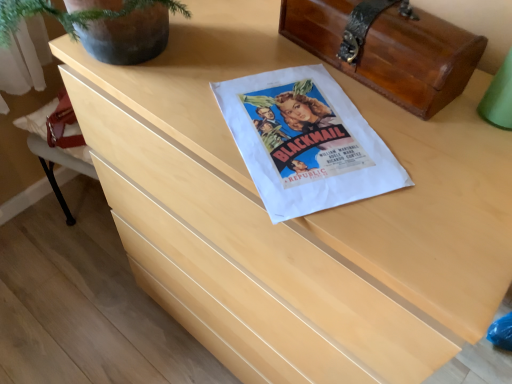
At what (x,y) coordinates should I click in order to perform the action: click on shiny brown wood chest at upper right. Please return your answer as a coordinate pair (x, y). Looking at the image, I should click on (390, 50).

What is the approximate width of shiny brown wood chest at upper right?

The width of shiny brown wood chest at upper right is 7.47 inches.

What do you see at coordinates (390, 50) in the screenshot?
I see `shiny brown wood chest at upper right` at bounding box center [390, 50].

You are a GUI agent. You are given a task and a screenshot of the screen. Output one action in this format:
    pyautogui.click(x=<x>, y=<y>)
    Task: Click on the white paper flyer at center
    
    Given the screenshot: What is the action you would take?
    pyautogui.click(x=305, y=142)

Measure the distance between white paper flyer at center and camera.

21.25 inches.

What do you see at coordinates (305, 142) in the screenshot? I see `white paper flyer at center` at bounding box center [305, 142].

Locate an element on the screen. shiny brown wood chest at upper right is located at coordinates (390, 50).

Considering the relative positions of shiny brown wood chest at upper right and white paper flyer at center in the image provided, is shiny brown wood chest at upper right to the left of white paper flyer at center from the viewer's perspective?

In fact, shiny brown wood chest at upper right is to the right of white paper flyer at center.

Considering their positions, is shiny brown wood chest at upper right located in front of or behind white paper flyer at center?

shiny brown wood chest at upper right is positioned farther from the viewer than white paper flyer at center.

Which is in front, point (431, 49) or point (251, 120)?

The point (431, 49) is closer to the camera.

From the image's perspective, is shiny brown wood chest at upper right under white paper flyer at center?

Actually, shiny brown wood chest at upper right appears above white paper flyer at center in the image.

From a real-world perspective, is shiny brown wood chest at upper right positioned above or below white paper flyer at center?

shiny brown wood chest at upper right is above white paper flyer at center.

Considering the sizes of objects shiny brown wood chest at upper right and white paper flyer at center in the image provided, who is thinner, shiny brown wood chest at upper right or white paper flyer at center?

With smaller width is shiny brown wood chest at upper right.

Is shiny brown wood chest at upper right shorter than white paper flyer at center?

Incorrect, the height of shiny brown wood chest at upper right does not fall short of that of white paper flyer at center.

Who is bigger, shiny brown wood chest at upper right or white paper flyer at center?

shiny brown wood chest at upper right is bigger.

Is white paper flyer at center surrounded by shiny brown wood chest at upper right?

No.

Based on the photo, are shiny brown wood chest at upper right and white paper flyer at center making contact?

No, shiny brown wood chest at upper right is not beside white paper flyer at center.

Is shiny brown wood chest at upper right facing away from white paper flyer at center?

No, shiny brown wood chest at upper right's orientation is not away from white paper flyer at center.

What's the angular difference between shiny brown wood chest at upper right and white paper flyer at center's facing directions?

The angular difference between shiny brown wood chest at upper right and white paper flyer at center is 65.6 degrees.

You are a GUI agent. You are given a task and a screenshot of the screen. Output one action in this format:
    pyautogui.click(x=<x>, y=<y>)
    Task: Click on the flyer that is in front of the shiny brown wood chest at upper right
    
    Given the screenshot: What is the action you would take?
    pyautogui.click(x=305, y=142)

Considering the relative positions of white paper flyer at center and shiny brown wood chest at upper right in the image provided, is white paper flyer at center to the left or to the right of shiny brown wood chest at upper right?

In the image, white paper flyer at center appears on the left side of shiny brown wood chest at upper right.

Which object is further away from the camera, white paper flyer at center or shiny brown wood chest at upper right?

shiny brown wood chest at upper right is further from the camera.

Considering the points (286, 142) and (410, 36), which point is in front, point (286, 142) or point (410, 36)?

Positioned in front is point (286, 142).

From the image's perspective, is white paper flyer at center below shiny brown wood chest at upper right?

Yes.

Looking at this image, from a real-world perspective, which is physically below, white paper flyer at center or shiny brown wood chest at upper right?

From a 3D spatial view, white paper flyer at center is below.

Between white paper flyer at center and shiny brown wood chest at upper right, which one has larger width?

Wider between the two is white paper flyer at center.

From the picture: Who is taller, white paper flyer at center or shiny brown wood chest at upper right?

Standing taller between the two is shiny brown wood chest at upper right.

Considering the sizes of objects white paper flyer at center and shiny brown wood chest at upper right in the image provided, who is smaller, white paper flyer at center or shiny brown wood chest at upper right?

With smaller size is white paper flyer at center.

Would you say white paper flyer at center is outside shiny brown wood chest at upper right?

white paper flyer at center is positioned outside shiny brown wood chest at upper right.

Does white paper flyer at center touch shiny brown wood chest at upper right?

No, white paper flyer at center is not with shiny brown wood chest at upper right.

Is shiny brown wood chest at upper right at the back of white paper flyer at center?

No.

Can you tell me how much white paper flyer at center and shiny brown wood chest at upper right differ in facing direction?

65.6 degrees separate the facing orientations of white paper flyer at center and shiny brown wood chest at upper right.

Identify the location of flyer on the left of shiny brown wood chest at upper right. (305, 142).

At what (x,y) coordinates should I click in order to perform the action: click on flyer that appears in front of the shiny brown wood chest at upper right. Please return your answer as a coordinate pair (x, y). This screenshot has height=384, width=512. Looking at the image, I should click on (305, 142).

You are a GUI agent. You are given a task and a screenshot of the screen. Output one action in this format:
    pyautogui.click(x=<x>, y=<y>)
    Task: Click on the flyer below the shiny brown wood chest at upper right (from a real-world perspective)
    The height and width of the screenshot is (384, 512).
    Given the screenshot: What is the action you would take?
    pyautogui.click(x=305, y=142)